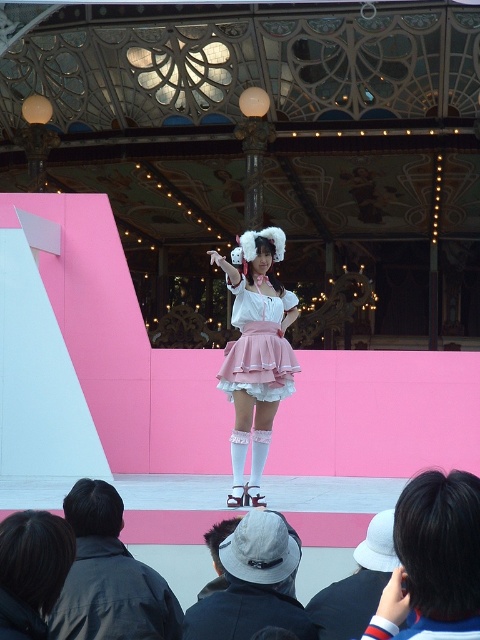
You are an audience member sitting in the front row of the stage. You notice two skirts at center stage, the matte pink skirt at center and the pink satin skirt at center. How far apart are these two skirts from each other?

The matte pink skirt at center is 8.24 feet away from the pink satin skirt at center.

You are an audience member sitting in the front row of the stage. You notice the black fabric jacket at lower left and the white cotton hat at lower center. Which object is located more to the left side?

The black fabric jacket at lower left is positioned on the left side of the white cotton hat at lower center, so it is more to the left.

You are a stagehand who needs to move a 3.5 meter long ladder from the black fabric jacket at lower left to the white cotton hat at lower center. Can you move the ladder without it extending beyond the objects?

The distance between the black fabric jacket at lower left and the white cotton hat at lower center is 2.92 meters. Since the ladder is 3.5 meters long, it would extend beyond the space between them. Therefore, you cannot move the ladder without it extending beyond the objects.